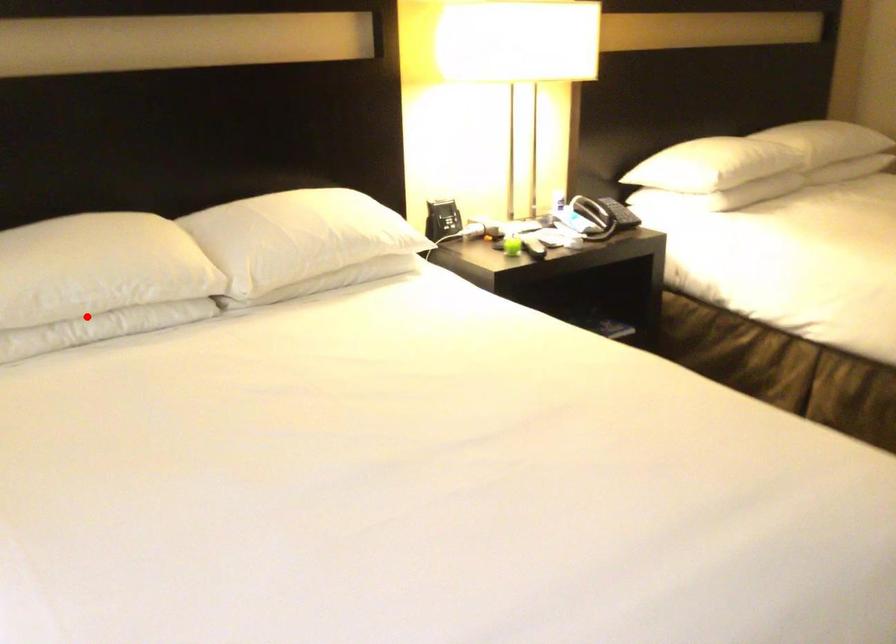
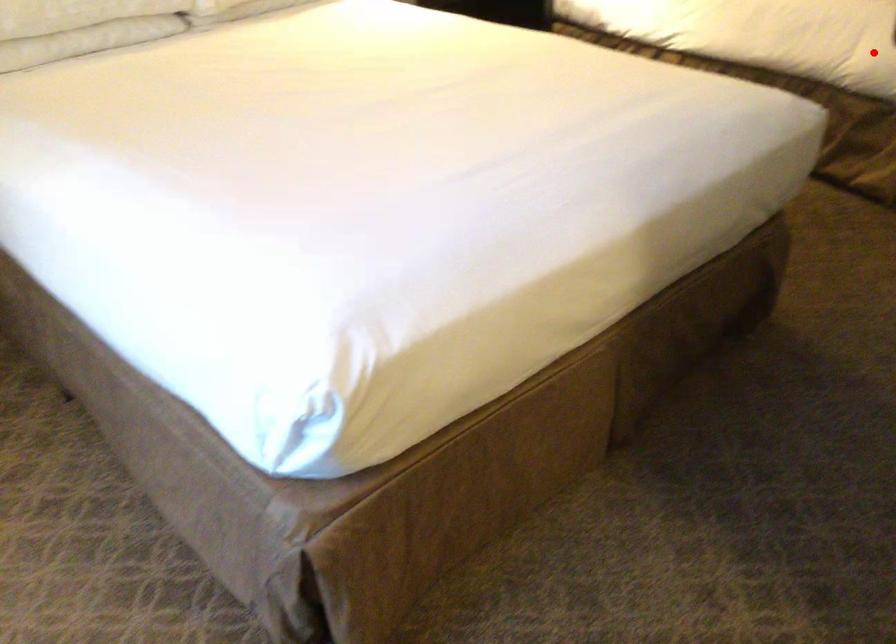
I am providing you with two images of the same scene from different viewpoints. A red point is marked on the first image and another point is marked on the second image. Is the marked point in image1 the same physical position as the marked point in image2?

No